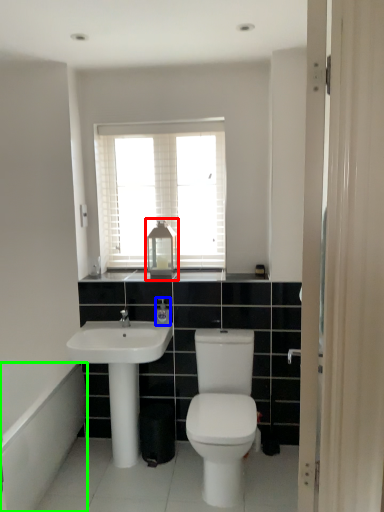
Question: Which is farther away from medicine cabinet (highlighted by a red box)? toiletry (highlighted by a blue box) or bath (highlighted by a green box)?

Choices:
 (A) toiletry
 (B) bath

Answer: (B)